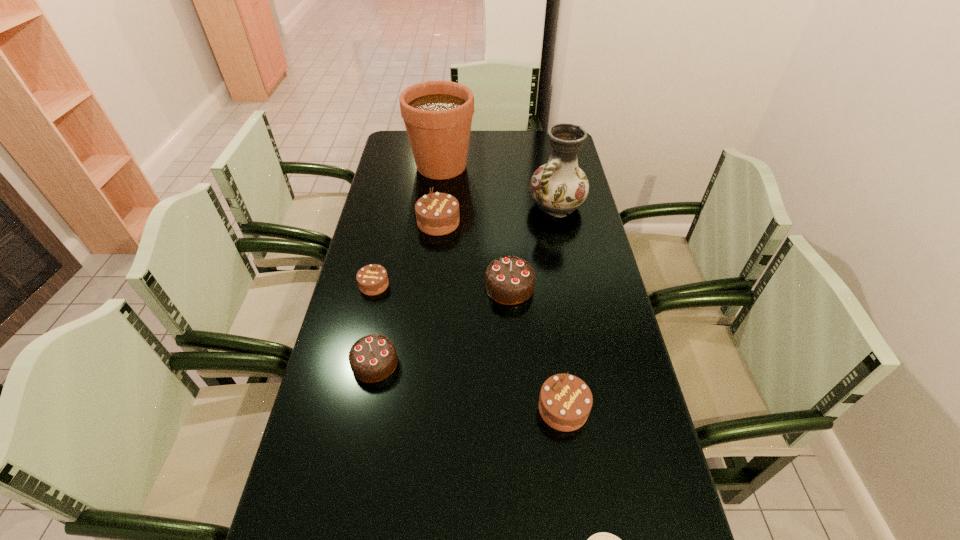
Where is `the closest chocolate chocolate cake to the second farthest brown chocolate cake`? the closest chocolate chocolate cake to the second farthest brown chocolate cake is located at coordinates (373, 358).

Where is `free spot that satisfies the following two spatial constraints: 1. on the front side of the bigger chocolate chocolate cake; 2. on the left side of the farthest chocolate cake`? The image size is (960, 540). free spot that satisfies the following two spatial constraints: 1. on the front side of the bigger chocolate chocolate cake; 2. on the left side of the farthest chocolate cake is located at coordinates (432, 287).

At what (x,y) coordinates should I click in order to perform the action: click on vacant space that satisfies the following two spatial constraints: 1. on the front side of the flowerpot; 2. on the right side of the bigger chocolate chocolate cake. Please return your answer as a coordinate pair (x, y). This screenshot has width=960, height=540. Looking at the image, I should click on (428, 287).

You are a GUI agent. You are given a task and a screenshot of the screen. Output one action in this format:
    pyautogui.click(x=<x>, y=<y>)
    Task: Click on the vacant space that satisfies the following two spatial constraints: 1. on the back side of the red vase; 2. on the left side of the third nearest object
    The height and width of the screenshot is (540, 960).
    Given the screenshot: What is the action you would take?
    pyautogui.click(x=405, y=206)